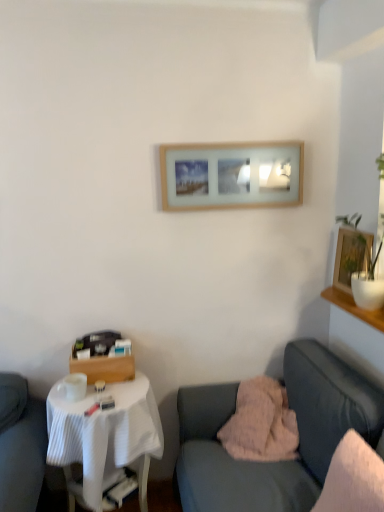
Question: Is white fabric-covered table at lower left further to camera compared to velvet pink blanket at lower right?

Choices:
 (A) yes
 (B) no

Answer: (A)

Question: Can you confirm if white fabric-covered table at lower left is positioned to the right of velvet pink blanket at lower right?

Choices:
 (A) no
 (B) yes

Answer: (A)

Question: Would you consider white fabric-covered table at lower left to be distant from velvet pink blanket at lower right?

Choices:
 (A) yes
 (B) no

Answer: (B)

Question: From the image's perspective, is white fabric-covered table at lower left below velvet pink blanket at lower right?

Choices:
 (A) yes
 (B) no

Answer: (A)

Question: Considering the relative sizes of white fabric-covered table at lower left and velvet pink blanket at lower right in the image provided, is white fabric-covered table at lower left thinner than velvet pink blanket at lower right?

Choices:
 (A) no
 (B) yes

Answer: (B)

Question: Can you confirm if white fabric-covered table at lower left is wider than velvet pink blanket at lower right?

Choices:
 (A) no
 (B) yes

Answer: (A)

Question: From the image's perspective, is fluffy pink pillow at lower center, the second pillow positioned from the front, on top of velvet pink blanket at lower right?

Choices:
 (A) no
 (B) yes

Answer: (B)

Question: Does fluffy pink pillow at lower center, the second pillow positioned from the front, appear on the left side of velvet pink blanket at lower right?

Choices:
 (A) no
 (B) yes

Answer: (B)

Question: Can you confirm if fluffy pink pillow at lower center, the second pillow positioned from the front, is taller than velvet pink blanket at lower right?

Choices:
 (A) yes
 (B) no

Answer: (B)

Question: Considering the relative positions of fluffy pink pillow at lower center, the first pillow viewed from the back, and velvet pink blanket at lower right in the image provided, is fluffy pink pillow at lower center, the first pillow viewed from the back, to the right of velvet pink blanket at lower right from the viewer's perspective?

Choices:
 (A) yes
 (B) no

Answer: (B)

Question: Does fluffy pink pillow at lower center, the second pillow positioned from the front, have a larger size compared to velvet pink blanket at lower right?

Choices:
 (A) yes
 (B) no

Answer: (B)

Question: From the image's perspective, does fluffy pink pillow at lower center, the first pillow viewed from the back, appear lower than velvet pink blanket at lower right?

Choices:
 (A) yes
 (B) no

Answer: (B)

Question: Is white soft pillow at right, the 2th pillow positioned from the back, not inside wooden framed picture at upper right, marked as the first picture frame in a bottom-to-top arrangement?

Choices:
 (A) no
 (B) yes

Answer: (B)